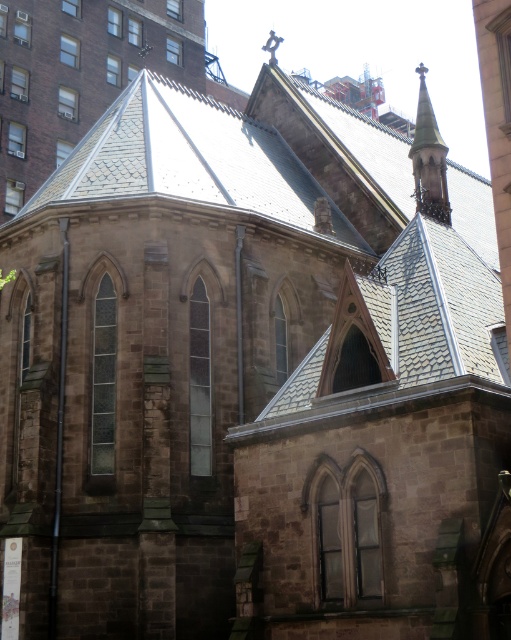
You are a drone operator tasked with capturing aerial footage of the historic stone church. The gray slate roof at upper center is your primary focus. Based on its position, can you confirm if the roof is centrally positioned on the church building?

The gray slate roof at upper center is located at point coordinates [182,157], which indicates it is positioned centrally on the church building.